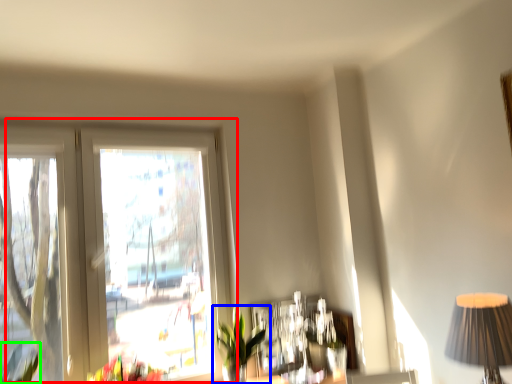
Question: Which object is positioned closest to window (highlighted by a red box)? Select from houseplant (highlighted by a blue box) and plant (highlighted by a green box).

Choices:
 (A) houseplant
 (B) plant

Answer: (A)